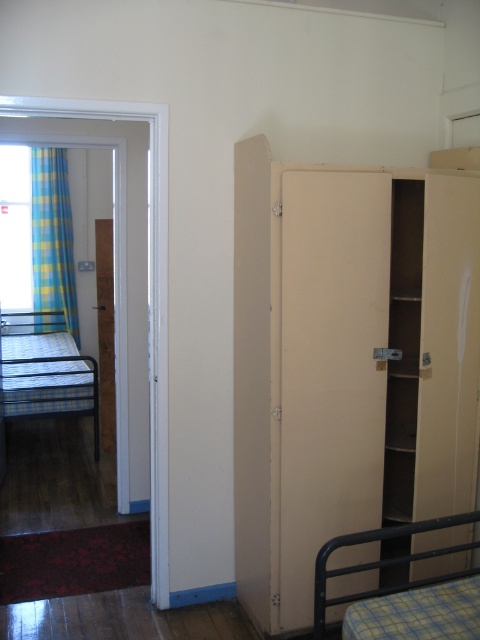
Question: Which point appears closest to the camera in this image?

Choices:
 (A) (x=63, y=246)
 (B) (x=324, y=561)
 (C) (x=418, y=266)
 (D) (x=24, y=404)

Answer: (B)

Question: Is metallic blue plaid bed at left above blue plaid fabric at left?

Choices:
 (A) no
 (B) yes

Answer: (A)

Question: Does metallic blue plaid bed at left have a larger size compared to blue plaid fabric at left?

Choices:
 (A) yes
 (B) no

Answer: (A)

Question: Is blue plaid fabric at left above plaid fabric bunk bed at lower right?

Choices:
 (A) no
 (B) yes

Answer: (B)

Question: Among these objects, which one is nearest to the camera?

Choices:
 (A) plaid fabric bunk bed at lower right
 (B) metallic blue plaid bed at left
 (C) blue plaid fabric at left
 (D) beige matte cabinet at right

Answer: (A)

Question: Which of the following is the farthest from the observer?

Choices:
 (A) (52, 356)
 (B) (323, 624)

Answer: (A)